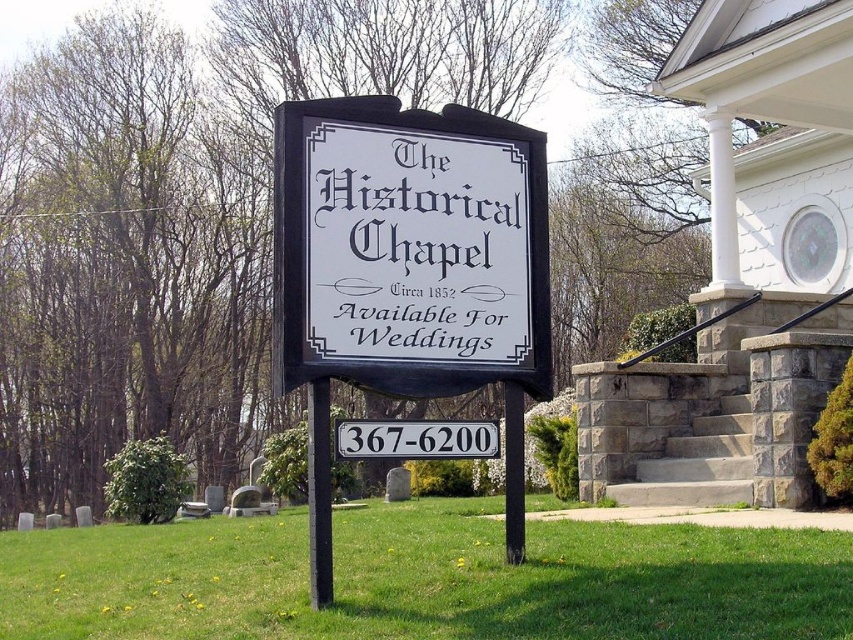
Question: Does white matte sign at center appear on the left side of black metal pole at center?

Choices:
 (A) yes
 (B) no

Answer: (B)

Question: Which is nearer to the black plastic pole at center?

Choices:
 (A) black paper sign at center
 (B) white matte sign at center

Answer: (A)

Question: Which object is the closest to the black plastic pole at center?

Choices:
 (A) black paper sign at center
 (B) black metal pole at center

Answer: (A)

Question: Is black metal pole at center in front of black plastic pole at center?

Choices:
 (A) no
 (B) yes

Answer: (B)

Question: Is the position of white matte sign at center less distant than that of black plastic pole at center?

Choices:
 (A) yes
 (B) no

Answer: (A)

Question: Which object is closer to the camera taking this photo?

Choices:
 (A) black paper sign at center
 (B) white matte sign at center
 (C) black plastic pole at center

Answer: (B)